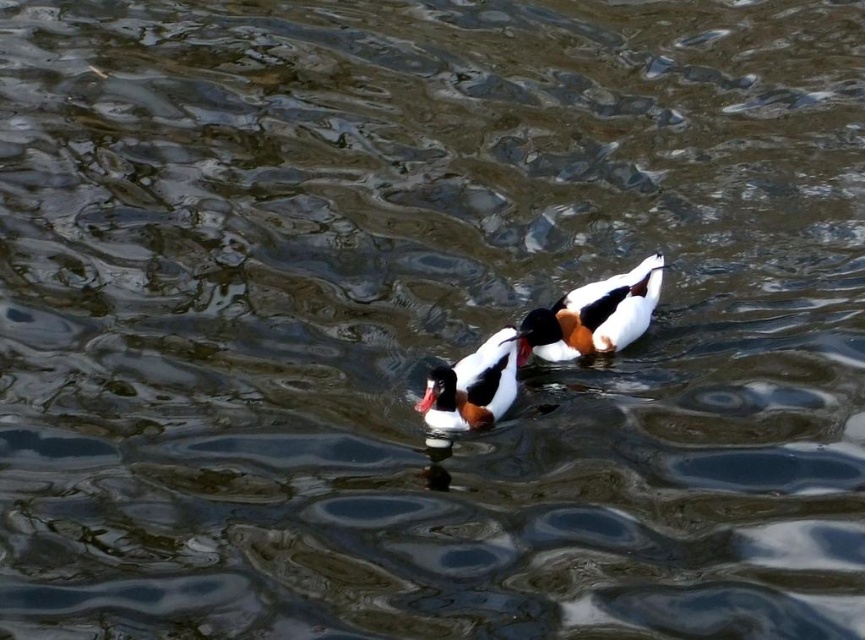
Is white glossy duck at center further to camera compared to white fluffy duck at center?

That is True.

Measure the distance from white glossy duck at center to white fluffy duck at center.

The distance of white glossy duck at center from white fluffy duck at center is 12.37 inches.

Is point (574, 300) positioned after point (481, 406)?

Yes, it is.

You are a GUI agent. You are given a task and a screenshot of the screen. Output one action in this format:
    pyautogui.click(x=<x>, y=<y>)
    Task: Click on the white glossy duck at center
    The image size is (865, 640).
    Given the screenshot: What is the action you would take?
    pyautogui.click(x=593, y=316)